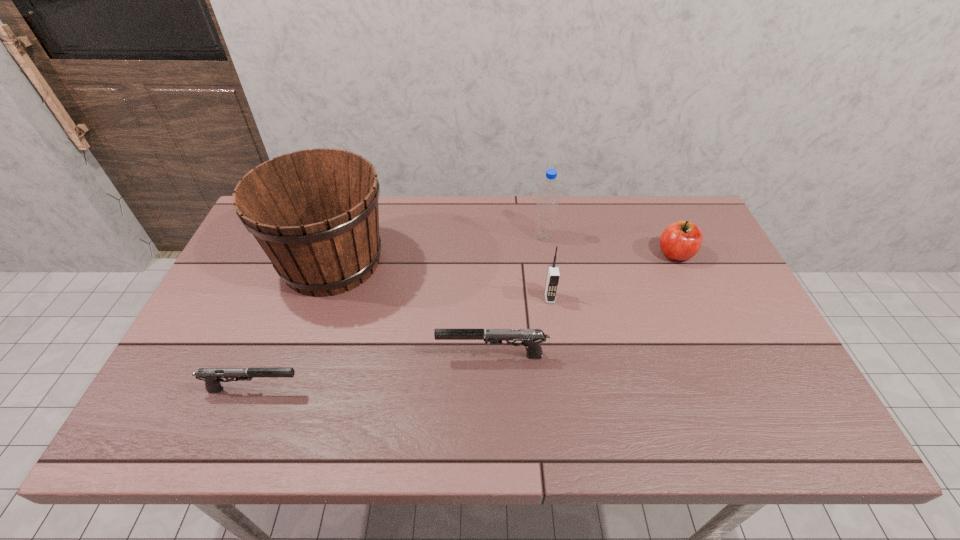
Where is `free point that keeps the guns evenly spaced on the right`? This screenshot has height=540, width=960. free point that keeps the guns evenly spaced on the right is located at coordinates (705, 326).